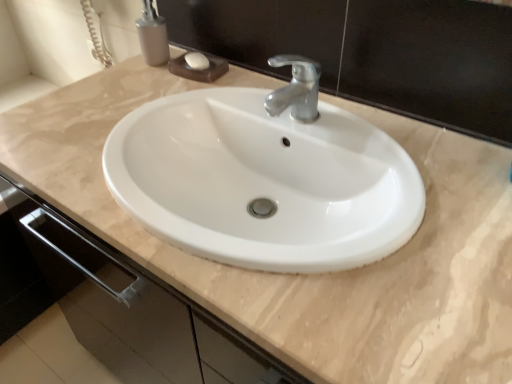
What do you see at coordinates (152, 35) in the screenshot? I see `matte gray soap dispenser at upper left` at bounding box center [152, 35].

In order to click on matte gray soap dispenser at upper left in this screenshot , I will do `click(152, 35)`.

Measure the distance between point (155,45) and camera.

Point (155,45) and camera are 1.04 meters apart.

Find the location of a particular element. white glossy soap at upper center is located at coordinates (197, 61).

Describe the element at coordinates (197, 61) in the screenshot. I see `white glossy soap at upper center` at that location.

Locate an element on the screen. The width and height of the screenshot is (512, 384). matte gray soap dispenser at upper left is located at coordinates (152, 35).

Which is more to the left, white glossy soap at upper center or matte gray soap dispenser at upper left?

From the viewer's perspective, matte gray soap dispenser at upper left appears more on the left side.

Is white glossy soap at upper center further to the viewer compared to matte gray soap dispenser at upper left?

Yes.

Is point (201, 70) farther from camera compared to point (138, 29)?

That is False.

From the image's perspective, is white glossy soap at upper center under matte gray soap dispenser at upper left?

Yes, from the image's perspective, white glossy soap at upper center is below matte gray soap dispenser at upper left.

From a real-world perspective, relative to matte gray soap dispenser at upper left, is white glossy soap at upper center vertically above or below?

From a real-world perspective, white glossy soap at upper center is physically below matte gray soap dispenser at upper left.

In terms of width, does white glossy soap at upper center look wider or thinner when compared to matte gray soap dispenser at upper left?

Clearly, white glossy soap at upper center has less width compared to matte gray soap dispenser at upper left.

Does white glossy soap at upper center have a lesser height compared to matte gray soap dispenser at upper left?

Yes.

Does white glossy soap at upper center have a larger size compared to matte gray soap dispenser at upper left?

Incorrect, white glossy soap at upper center is not larger than matte gray soap dispenser at upper left.

Is white glossy soap at upper center spatially inside matte gray soap dispenser at upper left, or outside of it?

white glossy soap at upper center is located beyond the bounds of matte gray soap dispenser at upper left.

Is the surface of white glossy soap at upper center in direct contact with matte gray soap dispenser at upper left?

Absolutely, white glossy soap at upper center is next to and touching matte gray soap dispenser at upper left.

Looking at this image, is white glossy soap at upper center facing towards matte gray soap dispenser at upper left?

→ No, white glossy soap at upper center is not aimed at matte gray soap dispenser at upper left.

Where is `soap directly beneath the matte gray soap dispenser at upper left (from a real-world perspective)`? soap directly beneath the matte gray soap dispenser at upper left (from a real-world perspective) is located at coordinates (197, 61).

Is matte gray soap dispenser at upper left to the right of white glossy soap at upper center from the viewer's perspective?

No, matte gray soap dispenser at upper left is not to the right of white glossy soap at upper center.

Is matte gray soap dispenser at upper left positioned in front of white glossy soap at upper center?

Yes, matte gray soap dispenser at upper left is closer to the viewer.

Considering the points (155, 37) and (203, 64), which point is behind, point (155, 37) or point (203, 64)?

Positioned behind is point (155, 37).

From the image's perspective, which is below, matte gray soap dispenser at upper left or white glossy soap at upper center?

white glossy soap at upper center is shown below in the image.

From a real-world perspective, is matte gray soap dispenser at upper left positioned under white glossy soap at upper center based on gravity?

No, from a real-world perspective, matte gray soap dispenser at upper left is not beneath white glossy soap at upper center.

Does matte gray soap dispenser at upper left have a greater width compared to white glossy soap at upper center?

Yes.

From their relative heights in the image, would you say matte gray soap dispenser at upper left is taller or shorter than white glossy soap at upper center?

In the image, matte gray soap dispenser at upper left appears to be taller than white glossy soap at upper center.

Who is smaller, matte gray soap dispenser at upper left or white glossy soap at upper center?

With smaller size is white glossy soap at upper center.

Is matte gray soap dispenser at upper left situated inside white glossy soap at upper center or outside?

matte gray soap dispenser at upper left is not inside white glossy soap at upper center, it's outside.

Is matte gray soap dispenser at upper left touching white glossy soap at upper center?

Yes, matte gray soap dispenser at upper left is right next to white glossy soap at upper center and making contact.

Based on the photo, is matte gray soap dispenser at upper left oriented towards white glossy soap at upper center?

No, matte gray soap dispenser at upper left does not turn towards white glossy soap at upper center.

Measure the distance between matte gray soap dispenser at upper left and white glossy soap at upper center.

A distance of 3.79 inches exists between matte gray soap dispenser at upper left and white glossy soap at upper center.

There is a white glossy soap at upper center. Where is `soap dispenser above it (from a real-world perspective)`? The width and height of the screenshot is (512, 384). soap dispenser above it (from a real-world perspective) is located at coordinates click(152, 35).

There is a white glossy soap at upper center. At what (x,y) coordinates should I click in order to perform the action: click on soap dispenser above it (from a real-world perspective). Please return your answer as a coordinate pair (x, y). Image resolution: width=512 pixels, height=384 pixels. Looking at the image, I should click on (152, 35).

You are a GUI agent. You are given a task and a screenshot of the screen. Output one action in this format:
    pyautogui.click(x=<x>, y=<y>)
    Task: Click on the soap located below the matte gray soap dispenser at upper left (from the image's perspective)
    This screenshot has width=512, height=384.
    Given the screenshot: What is the action you would take?
    [x=197, y=61]